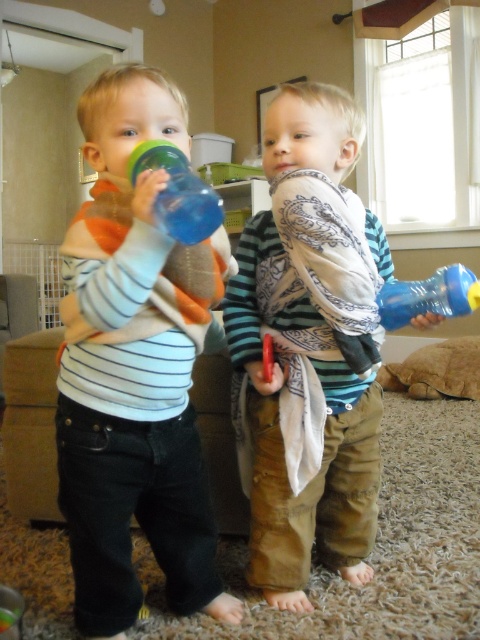
You are a parent trying to choose between two blue plastic bottles for your child. The blue plastic bottle at center and the blue plastic bottle at right are both available. Based on their sizes, which one might be more suitable for a younger child who has difficulty gripping larger items?

The blue plastic bottle at center has a smaller width than the blue plastic bottle at right, making it easier for a younger child to grip.

You are a delivery robot with a 25 centimeter wide arm. You need to place a package between the matte plastic water bottle at left and the blue plastic bottle at center. Can your arm fit between them to place the package?

The distance between the matte plastic water bottle at left and the blue plastic bottle at center is 24.16 centimeters, so the robot arm can fit as it is narrower than the 25 cm width required.

You are a parent trying to hand your child a drink. You see the blue rubber water bottle at center and the blue plastic bottle at right. Which one is closer to you?

The blue rubber water bottle at center is closer to you since it is in front of the blue plastic bottle at right.